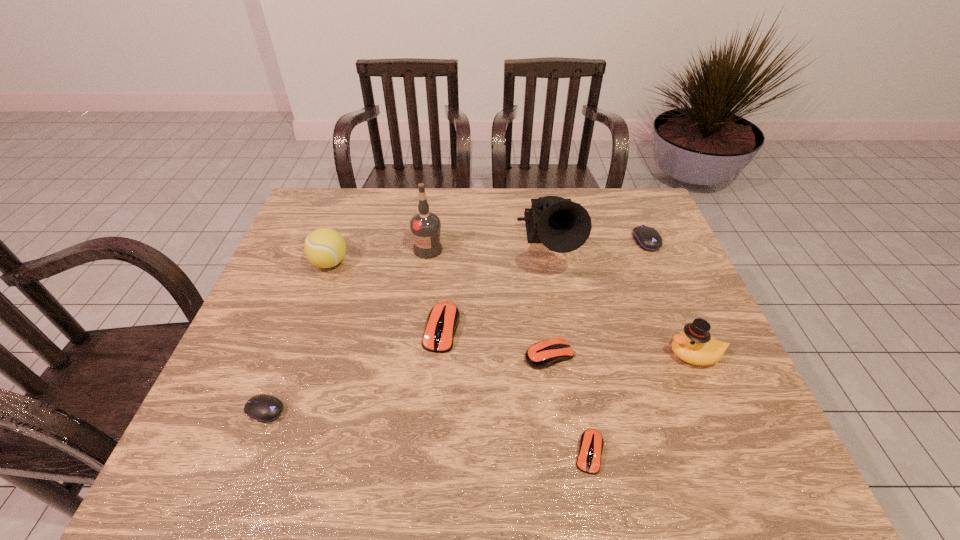
This screenshot has height=540, width=960. In order to click on free region located on the back of the rightmost computer mouse in this screenshot , I will do `click(637, 219)`.

Find the location of a particular element. The image size is (960, 540). free space located 0.140m on the right of the second smallest orange computer mouse is located at coordinates (633, 355).

Where is `free space located on the right of the left black computer mouse`? Image resolution: width=960 pixels, height=540 pixels. free space located on the right of the left black computer mouse is located at coordinates (457, 410).

Locate an element on the screen. This screenshot has height=540, width=960. vacant space located on the back of the nearest computer mouse is located at coordinates (575, 374).

I want to click on phonograph_record that is positioned at the far edge, so click(x=561, y=225).

Identify the location of computer mouse that is at the far edge. This screenshot has height=540, width=960. (647, 238).

The image size is (960, 540). Find the location of `object that is at the near edge`. object that is at the near edge is located at coordinates (x=591, y=442).

This screenshot has width=960, height=540. In order to click on tennis ball that is positioned at the left edge in this screenshot , I will do `click(325, 248)`.

At what (x,y) coordinates should I click in order to perform the action: click on computer mouse located in the left edge section of the desktop. Please return your answer as a coordinate pair (x, y). This screenshot has width=960, height=540. Looking at the image, I should click on 264,408.

Locate an element on the screen. This screenshot has width=960, height=540. duck situated at the right edge is located at coordinates [x=694, y=345].